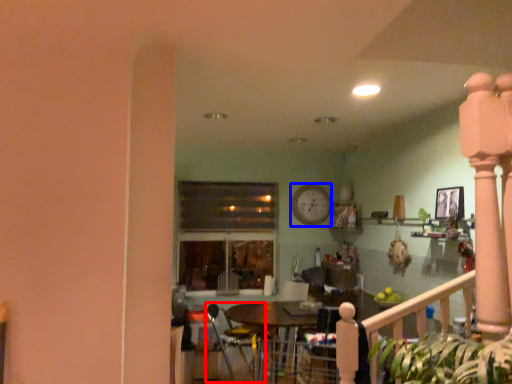
Question: Which object appears closest to the camera in this image, armchair (highlighted by a red box) or clock (highlighted by a blue box)?

Choices:
 (A) armchair
 (B) clock

Answer: (A)